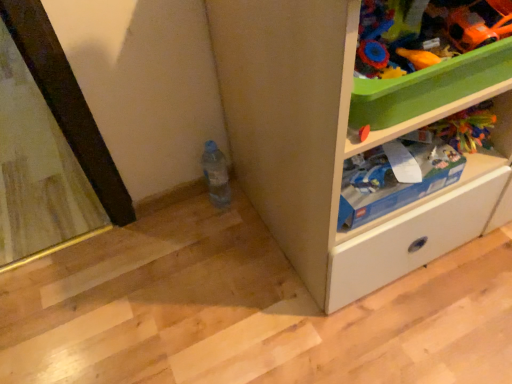
Measure the distance between blue cardboard box at upper right and camera.

blue cardboard box at upper right is 24.35 inches away from camera.

Find the location of a particular element. This screenshot has width=512, height=384. orange matte car at upper right, which appears as the first toy when viewed from the right is located at coordinates (479, 24).

In the scene shown: From the image's perspective, which object appears higher, orange plastic spoon at upper right, the first toy from the left, or translucent plastic bottle at lower center?

orange plastic spoon at upper right, the first toy from the left, appears higher in the image.

Does orange plastic spoon at upper right, the 2th toy positioned from the right, have a greater width compared to translucent plastic bottle at lower center?

No, orange plastic spoon at upper right, the 2th toy positioned from the right, is not wider than translucent plastic bottle at lower center.

Is orange plastic spoon at upper right, the first toy from the left, with translucent plastic bottle at lower center?

No, orange plastic spoon at upper right, the first toy from the left, is not beside translucent plastic bottle at lower center.

Is point (396, 51) closer or farther from the camera than point (217, 163)?

Point (396, 51).

Which object is positioned more to the left, white matte cabinet at lower right or translucent plastic bottle at lower center?

Positioned to the left is translucent plastic bottle at lower center.

How far apart are white matte cabinet at lower right and translucent plastic bottle at lower center?

The distance of white matte cabinet at lower right from translucent plastic bottle at lower center is 18.03 inches.

Considering the sizes of objects white matte cabinet at lower right and translucent plastic bottle at lower center in the image provided, who is taller, white matte cabinet at lower right or translucent plastic bottle at lower center?

white matte cabinet at lower right is taller.

Does translucent plastic bottle at lower center come behind orange matte car at upper right, which is the second toy in left-to-right order?

Yes.

Is point (218, 172) positioned before point (454, 41)?

No.

Is translucent plastic bottle at lower center oriented towards orange matte car at upper right, which appears as the first toy when viewed from the right?

No, translucent plastic bottle at lower center is not turned towards orange matte car at upper right, which appears as the first toy when viewed from the right.

In the scene shown: Looking at the image, does translucent plastic bottle at lower center seem bigger or smaller compared to orange matte car at upper right, which appears as the first toy when viewed from the right?

Considering their sizes, translucent plastic bottle at lower center takes up more space than orange matte car at upper right, which appears as the first toy when viewed from the right.

Is translucent plastic bottle at lower center thinner than orange plastic spoon at upper right, the 2th toy positioned from the right?

No.

From the image's perspective, relative to orange plastic spoon at upper right, the first toy from the left, is translucent plastic bottle at lower center above or below?

translucent plastic bottle at lower center is below orange plastic spoon at upper right, the first toy from the left.

From their relative heights in the image, would you say translucent plastic bottle at lower center is taller or shorter than orange plastic spoon at upper right, the first toy from the left?

translucent plastic bottle at lower center is taller than orange plastic spoon at upper right, the first toy from the left.

From the image's perspective, who appears lower, blue cardboard box at upper right or orange matte car at upper right, which appears as the first toy when viewed from the right?

blue cardboard box at upper right.

Is blue cardboard box at upper right outside of orange matte car at upper right, which is the second toy in left-to-right order?

Absolutely, blue cardboard box at upper right is external to orange matte car at upper right, which is the second toy in left-to-right order.

Is point (504, 105) in front of point (468, 12)?

No, (504, 105) is further to viewer.

From their relative heights in the image, would you say blue cardboard box at upper right is taller or shorter than orange matte car at upper right, which is the second toy in left-to-right order?

blue cardboard box at upper right is taller than orange matte car at upper right, which is the second toy in left-to-right order.

Which object is closer to the camera, blue cardboard box at upper right or white matte cabinet at lower right?

white matte cabinet at lower right.

Does blue cardboard box at upper right have a larger size compared to white matte cabinet at lower right?

No, blue cardboard box at upper right is not bigger than white matte cabinet at lower right.

From a real-world perspective, is blue cardboard box at upper right on white matte cabinet at lower right?

No, from a real-world perspective, blue cardboard box at upper right is not over white matte cabinet at lower right

Choose the correct answer: Is translucent plastic bottle at lower center inside blue cardboard box at upper right or outside it?

translucent plastic bottle at lower center is not inside blue cardboard box at upper right, it's outside.

You are a GUI agent. You are given a task and a screenshot of the screen. Output one action in this format:
    pyautogui.click(x=<x>, y=<y>)
    Task: Click on the bottle above the blue cardboard box at upper right (from the image's perspective)
    This screenshot has width=512, height=384.
    Given the screenshot: What is the action you would take?
    pyautogui.click(x=216, y=174)

Does translucent plastic bottle at lower center have a lesser width compared to blue cardboard box at upper right?

Indeed, translucent plastic bottle at lower center has a lesser width compared to blue cardboard box at upper right.

There is a translucent plastic bottle at lower center. Identify the location of the 1st toy above it (from the image's perspective). The height and width of the screenshot is (384, 512). (418, 57).

Find the location of a particular element. This screenshot has height=384, width=512. bottle that is below the white matte cabinet at lower right (from the image's perspective) is located at coordinates (216, 174).

Based on their spatial positions, is translucent plastic bottle at lower center or white matte cabinet at lower right closer to blue cardboard box at upper right?

The object closer to blue cardboard box at upper right is white matte cabinet at lower right.

When comparing their distances from translucent plastic bottle at lower center, does orange plastic spoon at upper right, the 2th toy positioned from the right, or orange matte car at upper right, which appears as the first toy when viewed from the right, seem further?

orange matte car at upper right, which appears as the first toy when viewed from the right, is further to translucent plastic bottle at lower center.

Which object lies nearer to the anchor point blue cardboard box at upper right, orange matte car at upper right, which is the second toy in left-to-right order, or white matte cabinet at lower right?

The object closer to blue cardboard box at upper right is white matte cabinet at lower right.

Looking at the image, which one is located closer to blue cardboard box at upper right, orange plastic spoon at upper right, the first toy from the left, or translucent plastic bottle at lower center?

orange plastic spoon at upper right, the first toy from the left, is positioned closer to the anchor blue cardboard box at upper right.

In the scene shown: Looking at the image, which one is located closer to orange matte car at upper right, which is the second toy in left-to-right order, translucent plastic bottle at lower center or white matte cabinet at lower right?

white matte cabinet at lower right.

Based on their spatial positions, is blue cardboard box at upper right or orange plastic spoon at upper right, the first toy from the left, closer to orange matte car at upper right, which is the second toy in left-to-right order?

The object closer to orange matte car at upper right, which is the second toy in left-to-right order, is orange plastic spoon at upper right, the first toy from the left.

Which object lies further to the anchor point orange matte car at upper right, which appears as the first toy when viewed from the right, blue cardboard box at upper right or translucent plastic bottle at lower center?

translucent plastic bottle at lower center.

Estimate the real-world distances between objects in this image. Which object is further from white matte cabinet at lower right, translucent plastic bottle at lower center or orange plastic spoon at upper right, the first toy from the left?

Among the two, translucent plastic bottle at lower center is located further to white matte cabinet at lower right.

Where is `shelf between white matte cabinet at lower right and translucent plastic bottle at lower center along the z-axis`? Image resolution: width=512 pixels, height=384 pixels. shelf between white matte cabinet at lower right and translucent plastic bottle at lower center along the z-axis is located at coordinates (459, 110).

The height and width of the screenshot is (384, 512). In order to click on shelf situated between translucent plastic bottle at lower center and orange matte car at upper right, which appears as the first toy when viewed from the right, from left to right in this screenshot , I will do `click(459, 110)`.

In order to click on toy located between white matte cabinet at lower right and orange plastic spoon at upper right, the first toy from the left, in the depth direction in this screenshot , I will do `click(479, 24)`.

Locate an element on the screen. This screenshot has height=384, width=512. shelf between orange plastic spoon at upper right, the first toy from the left, and translucent plastic bottle at lower center from front to back is located at coordinates (x=459, y=110).